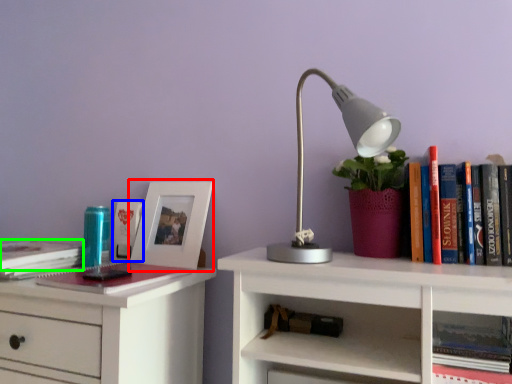
Question: Which object is positioned closest to picture frame (highlighted by a red box)? Select from book (highlighted by a blue box) and book (highlighted by a green box).

Choices:
 (A) book
 (B) book

Answer: (A)